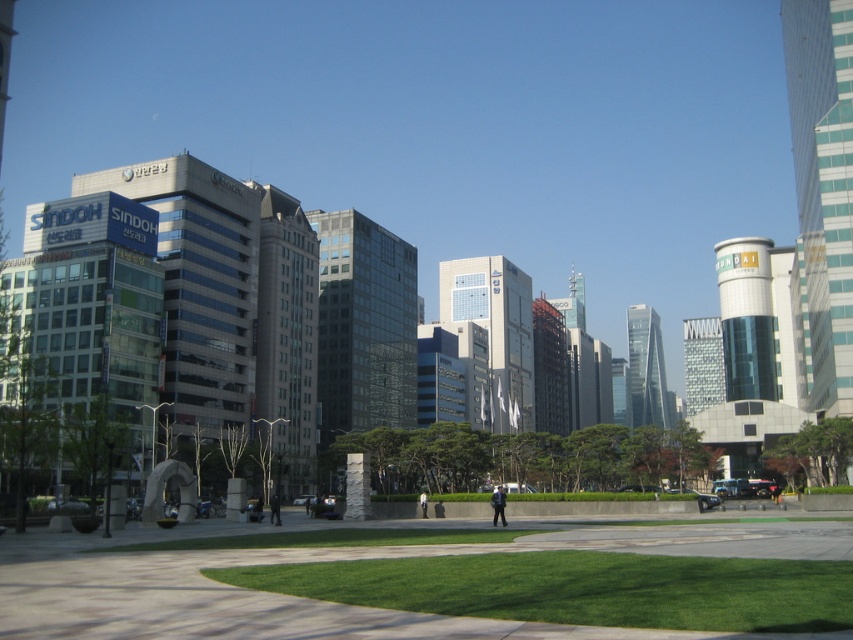
Please look at the image and provide the exact coordinates of the dark blue uniform at center. The coordinates should be in the format of a point with two decimal places, such as point (498, 504). Your answer should only include the coordinates in the specified format without any additional text.

point (498, 504)

Looking at this image, you are a security guard assigned to the public square. Your duty is to monitor the area from your current position at the center. Where exactly should you position yourself to ensure you can see the dark blue uniform at center clearly?

You should position yourself at point [498,504] to clearly see the dark blue uniform at center.